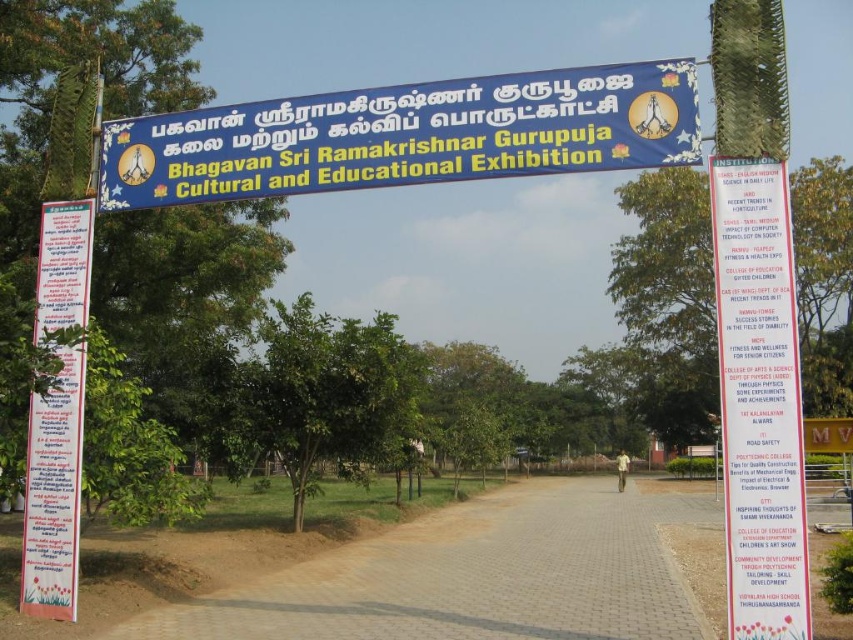
Question: Which is farther from the brown brick path at center?

Choices:
 (A) blue fabric banner at upper center
 (B) white paper sign at left
 (C) white paper list at right

Answer: (C)

Question: Among these points, which one is nearest to the camera?

Choices:
 (A) (767, 611)
 (B) (184, 621)
 (C) (236, 150)

Answer: (A)

Question: Is blue fabric banner at upper center wider than white paper sign at left?

Choices:
 (A) yes
 (B) no

Answer: (B)

Question: Does brown brick path at center appear over white paper sign at left?

Choices:
 (A) no
 (B) yes

Answer: (A)

Question: Among these points, which one is nearest to the camera?

Choices:
 (A) (122, 209)
 (B) (579, 492)
 (C) (749, 298)

Answer: (C)

Question: Is blue fabric banner at upper center to the right of white paper list at right from the viewer's perspective?

Choices:
 (A) yes
 (B) no

Answer: (B)